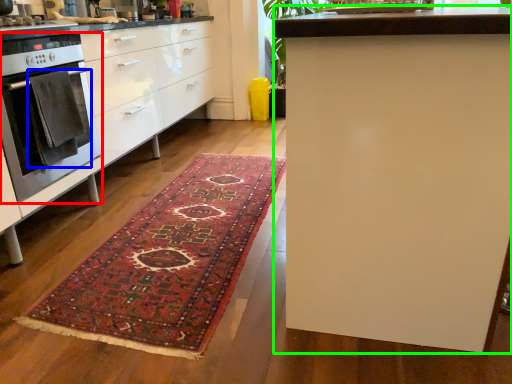
Question: Which is nearer to the home appliance (highlighted by a red box)? blanket (highlighted by a blue box) or table (highlighted by a green box).

Choices:
 (A) blanket
 (B) table

Answer: (A)